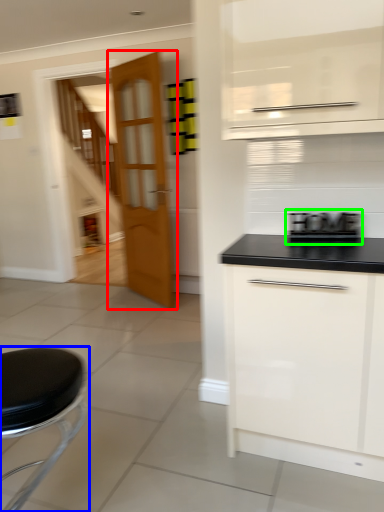
Question: Which object is positioned farthest from door (highlighted by a red box)? Select from furniture (highlighted by a blue box) and appliance (highlighted by a green box).

Choices:
 (A) furniture
 (B) appliance

Answer: (A)